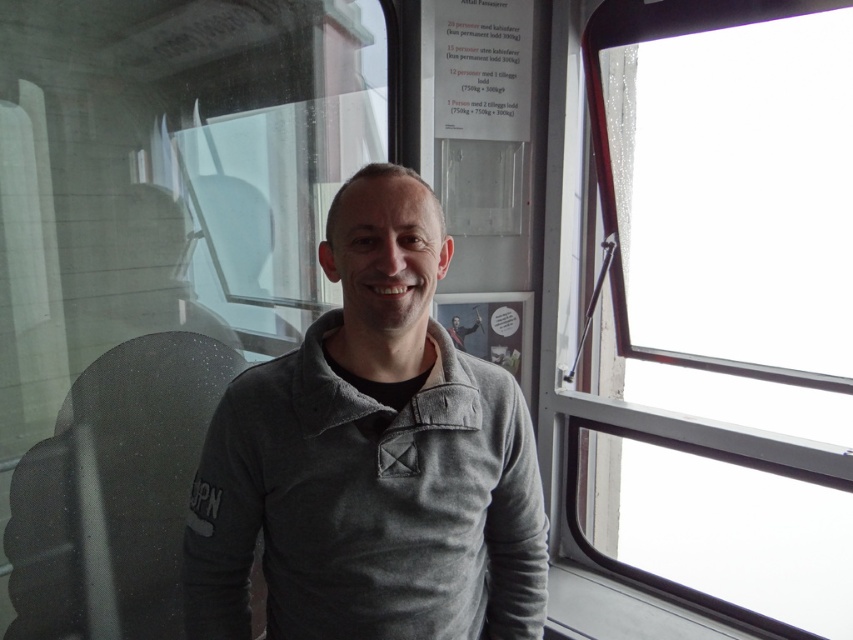
Is point (679, 163) positioned after point (378, 429)?

Yes, it is behind point (378, 429).

Based on the photo, is clear glass window at right smaller than gray fleece sweater at center?

No.

Between point (825, 522) and point (491, 532), which one is positioned in front?

Point (491, 532)

Find the location of `clear glass window at right`. clear glass window at right is located at coordinates (721, 308).